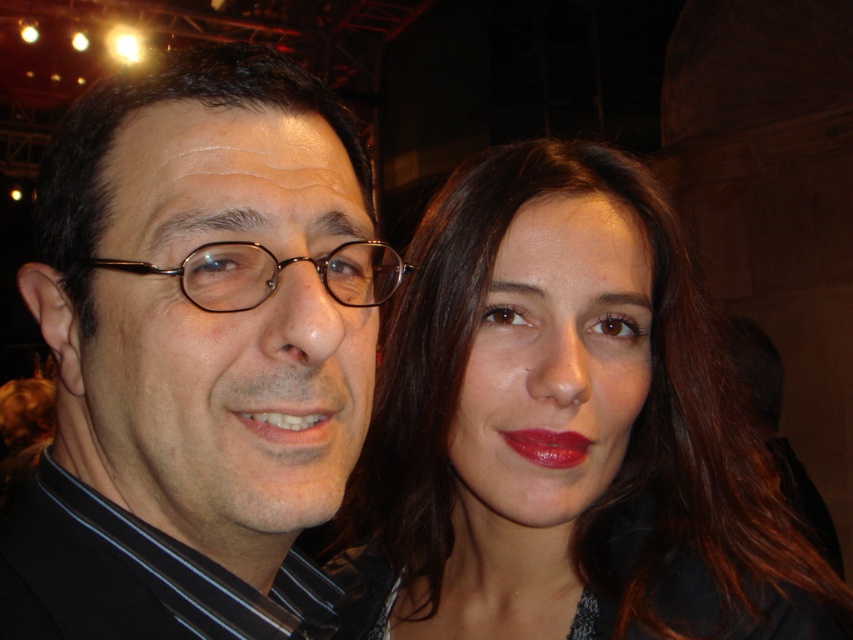
The height and width of the screenshot is (640, 853). What do you see at coordinates (194, 353) in the screenshot?
I see `matte black glasses at left` at bounding box center [194, 353].

Between matte black glasses at left and metallic round glasses at center, which one appears on the right side from the viewer's perspective?

metallic round glasses at center is more to the right.

What do you see at coordinates (194, 353) in the screenshot?
I see `matte black glasses at left` at bounding box center [194, 353].

I want to click on matte black glasses at left, so click(x=194, y=353).

Does shiny red lipstick at center come in front of matte red lipstick at center?

No, it is behind matte red lipstick at center.

Where is `shiny red lipstick at center`? The width and height of the screenshot is (853, 640). shiny red lipstick at center is located at coordinates [548, 445].

Between matte black glasses at left and smooth brown hair at center, which one appears on the right side from the viewer's perspective?

smooth brown hair at center

Does matte black glasses at left have a greater width compared to smooth brown hair at center?

Incorrect, matte black glasses at left's width does not surpass smooth brown hair at center's.

Where is `matte black glasses at left`? matte black glasses at left is located at coordinates (194, 353).

Locate an element on the screen. The width and height of the screenshot is (853, 640). matte black glasses at left is located at coordinates (194, 353).